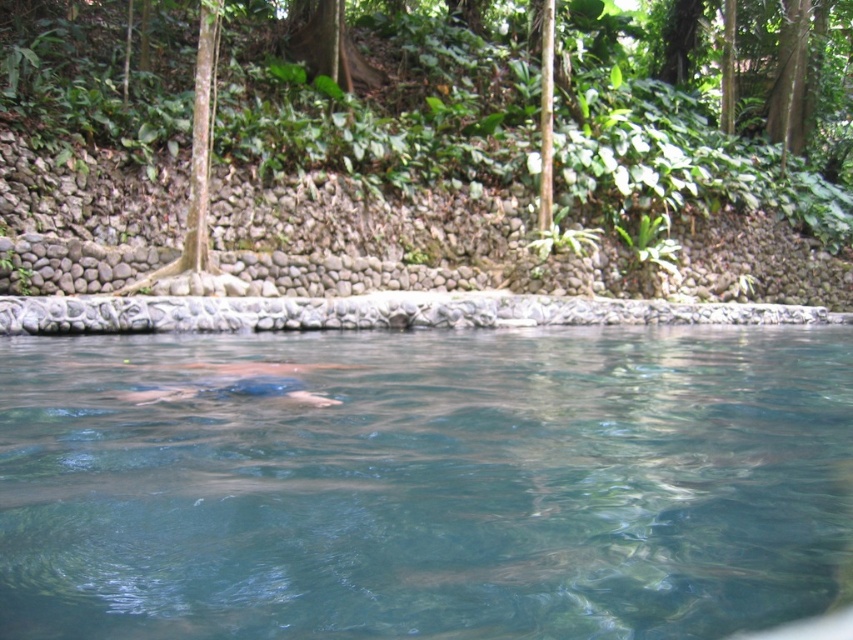
Question: From the image, what is the correct spatial relationship of clear water at center in relation to blue fabric at center?

Choices:
 (A) right
 (B) left

Answer: (A)

Question: From the image, what is the correct spatial relationship of clear water at center in relation to blue fabric at center?

Choices:
 (A) above
 (B) below

Answer: (B)

Question: Is clear water at center below blue fabric at center?

Choices:
 (A) no
 (B) yes

Answer: (B)

Question: Which point is farther to the camera?

Choices:
 (A) clear water at center
 (B) blue fabric at center

Answer: (B)